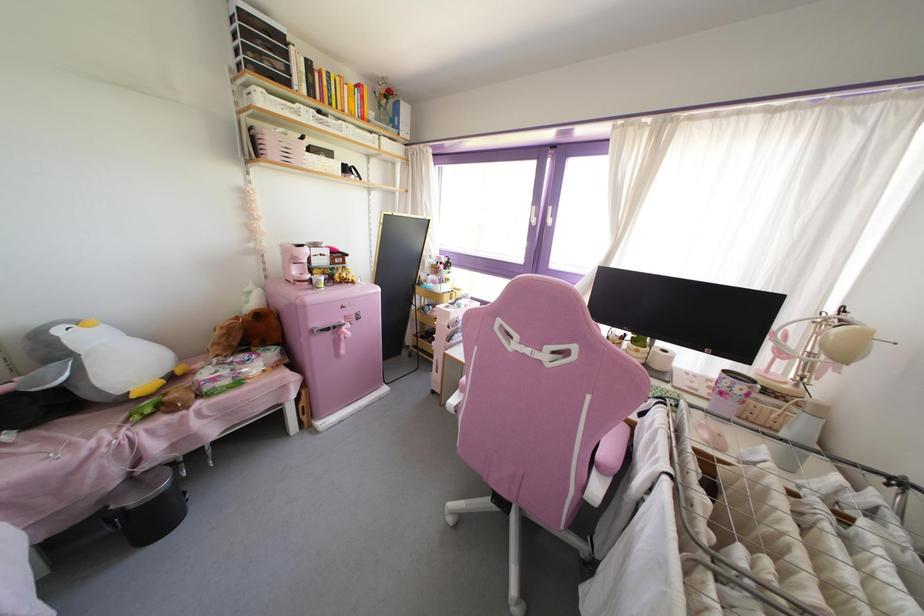
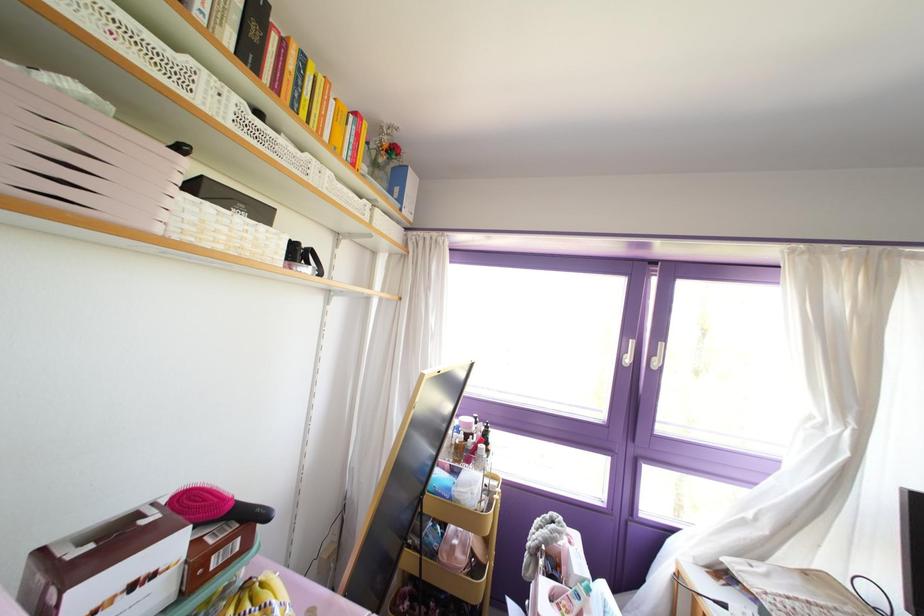
Find the pixel in the second image that matches pixel 532 220 in the first image.

(626, 360)